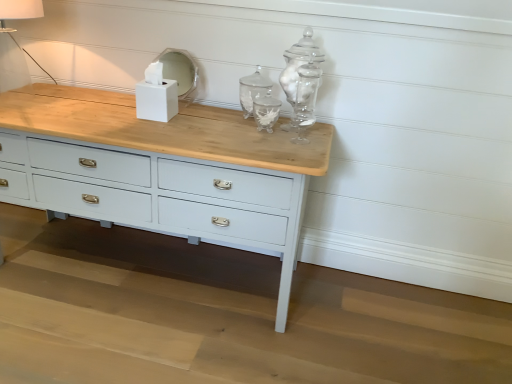
Question: From the image's perspective, is white fabric lampshade at upper left positioned above or below white matte tissue box at center?

Choices:
 (A) above
 (B) below

Answer: (A)

Question: Would you say white fabric lampshade at upper left is inside or outside white matte tissue box at center?

Choices:
 (A) outside
 (B) inside

Answer: (A)

Question: Considering the real-world distances, which object is farthest from the white glossy mirror at upper center?

Choices:
 (A) white fabric lampshade at upper left
 (B) white matte tissue box at center

Answer: (A)

Question: Based on their relative distances, which object is farther from the white glossy mirror at upper center?

Choices:
 (A) white fabric lampshade at upper left
 (B) white matte tissue box at center

Answer: (A)